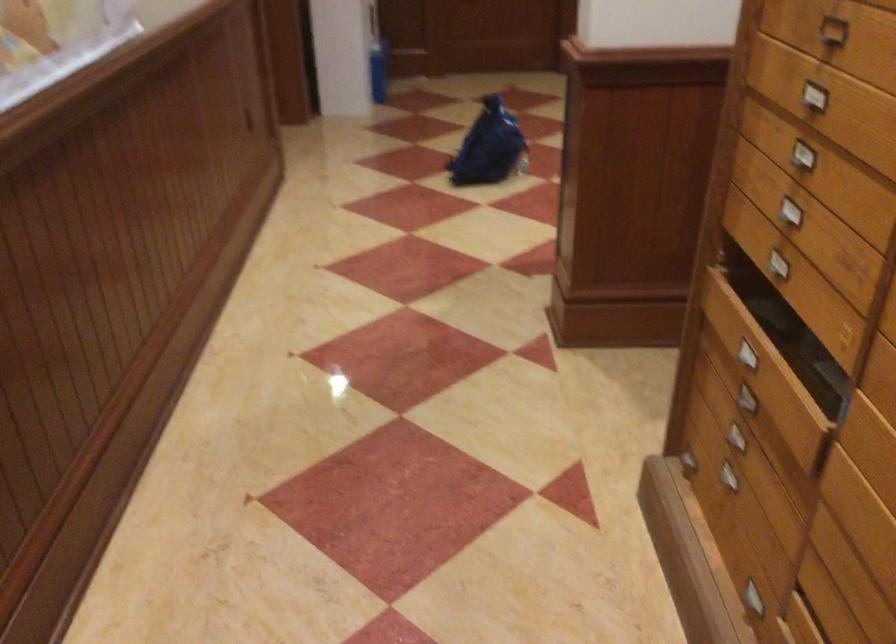
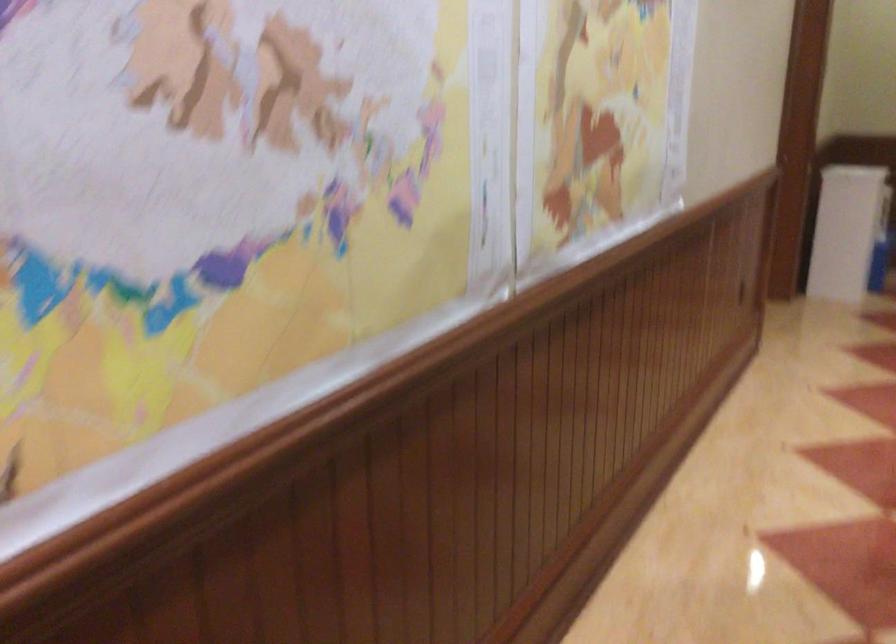
Question: The camera is either moving clockwise (left) or counter-clockwise (right) around the object. The first image is from the beginning of the video and the second image is from the end. Is the camera moving left or right when shooting the video?

Choices:
 (A) Left
 (B) Right

Answer: (B)